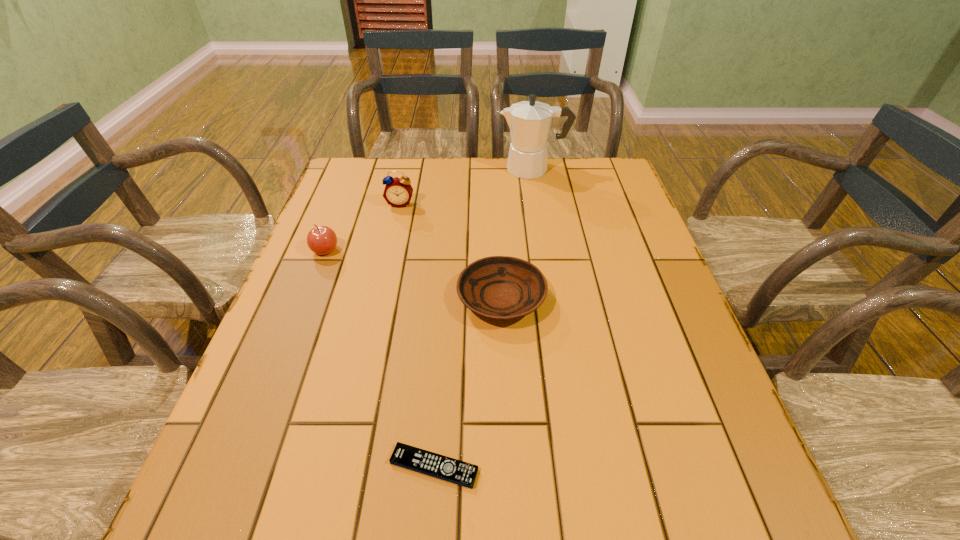
I want to click on vacant space at the far edge of the desktop, so click(x=423, y=187).

Locate an element on the screen. The width and height of the screenshot is (960, 540). free space at the near edge is located at coordinates (517, 491).

In the image, there is a desktop. Identify the location of vacant space at the left edge. This screenshot has width=960, height=540. (326, 211).

The width and height of the screenshot is (960, 540). Identify the location of vacant space at the right edge of the desktop. (628, 213).

Where is `vacant space at the far left corner`? vacant space at the far left corner is located at coordinates (332, 185).

Locate an element on the screen. free spot between the fourth nearest object and the coffeepot is located at coordinates (467, 186).

Where is `free space between the remote control and the second shortest object`? The width and height of the screenshot is (960, 540). free space between the remote control and the second shortest object is located at coordinates (468, 382).

This screenshot has height=540, width=960. Find the location of `free space between the fourth object from right to left and the shortest object`. free space between the fourth object from right to left and the shortest object is located at coordinates (417, 335).

The height and width of the screenshot is (540, 960). I want to click on free space between the second farthest object and the tallest object, so click(467, 186).

You are a GUI agent. You are given a task and a screenshot of the screen. Output one action in this format:
    pyautogui.click(x=<x>, y=<y>)
    Task: Click on the free point between the tallest object and the remote control
    The width and height of the screenshot is (960, 540).
    Given the screenshot: What is the action you would take?
    pyautogui.click(x=484, y=318)